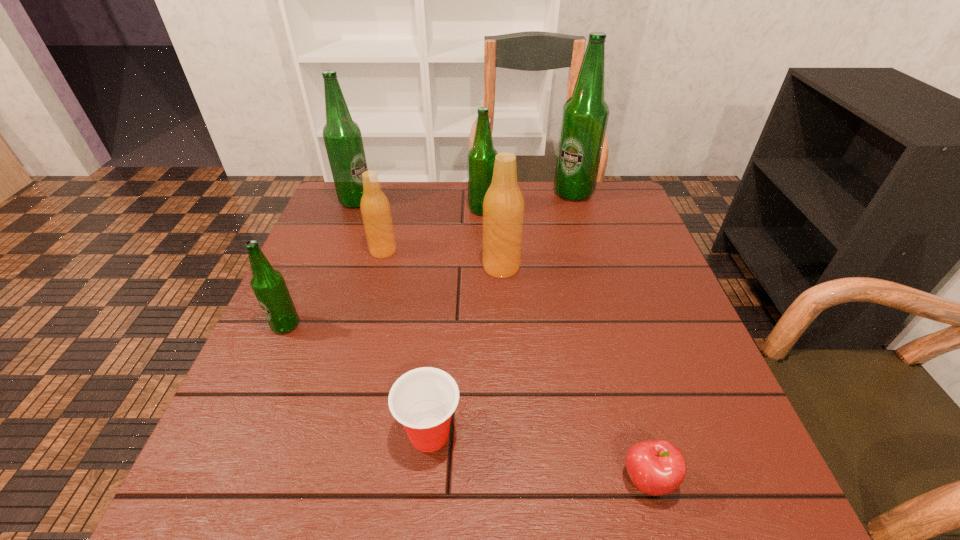
Locate an element on the screen. This screenshot has width=960, height=540. the tallest beer bottle is located at coordinates (585, 115).

Find the location of a particular element. The image size is (960, 540). the rightmost green beer bottle is located at coordinates (585, 115).

The width and height of the screenshot is (960, 540). I want to click on the third smallest green beer bottle, so click(342, 136).

Locate an element on the screen. This screenshot has width=960, height=540. the second tallest object is located at coordinates (342, 136).

This screenshot has width=960, height=540. In order to click on the third biggest green beer bottle in this screenshot , I will do `click(481, 157)`.

Image resolution: width=960 pixels, height=540 pixels. I want to click on the bigger tan beer bottle, so click(503, 206).

Where is `the smaller tan beer bottle`? The image size is (960, 540). the smaller tan beer bottle is located at coordinates (375, 208).

Locate an element on the screen. The image size is (960, 540). the fourth beer bottle from right to left is located at coordinates (375, 208).

Locate an element on the screen. the third nearest object is located at coordinates (269, 287).

At what (x,y) coordinates should I click in order to perform the action: click on the nearest green beer bottle. Please return your answer as a coordinate pair (x, y). This screenshot has width=960, height=540. Looking at the image, I should click on (269, 287).